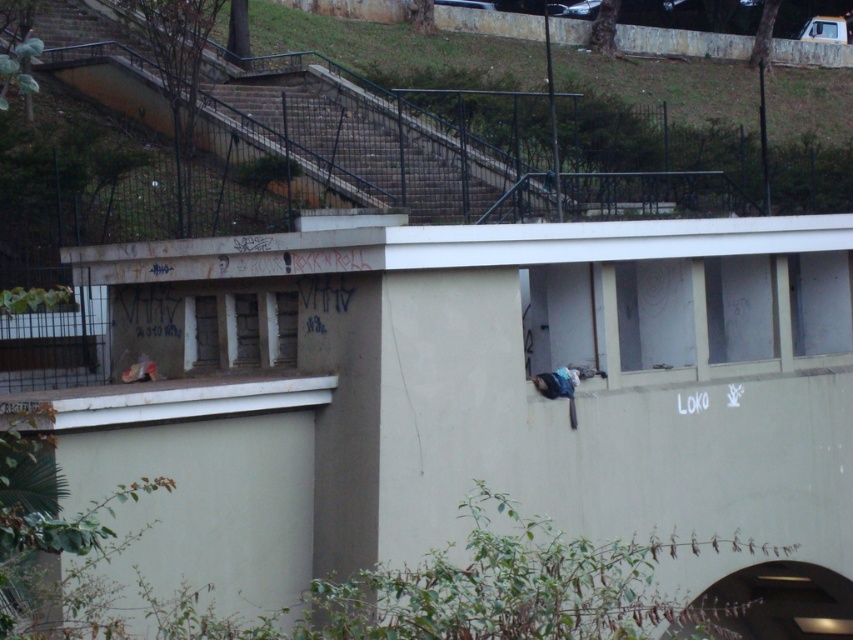
Question: Observing the image, what is the correct spatial positioning of concrete stairs at upper center in reference to metallic gray stairs at upper center?

Choices:
 (A) right
 (B) left

Answer: (B)

Question: Which point is closer to the camera taking this photo?

Choices:
 (A) (834, 344)
 (B) (465, 122)
 (C) (300, 77)

Answer: (A)

Question: Is the position of transparent glass window at upper center more distant than that of transparent glass window at upper right?

Choices:
 (A) no
 (B) yes

Answer: (A)

Question: Which object is the closest to the transparent glass window at upper right?

Choices:
 (A) transparent glass window at upper center
 (B) concrete stairs at upper center
 (C) metallic gray stairs at upper center

Answer: (A)

Question: Which object is farther from the camera taking this photo?

Choices:
 (A) transparent glass window at upper center
 (B) transparent glass window at upper right
 (C) metallic gray stairs at upper center
 (D) concrete stairs at upper center

Answer: (C)

Question: Is concrete stairs at upper center smaller than metallic gray stairs at upper center?

Choices:
 (A) yes
 (B) no

Answer: (B)